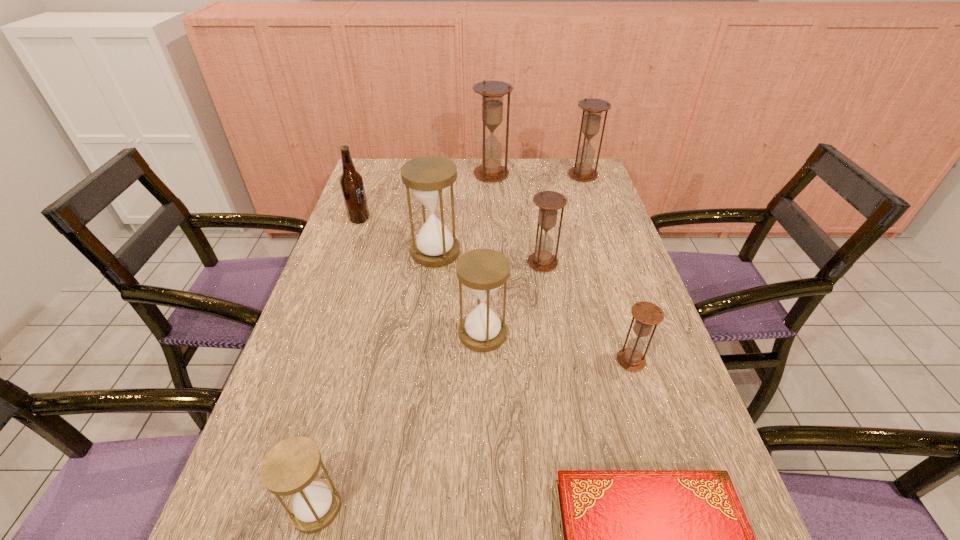
The width and height of the screenshot is (960, 540). In order to click on the rightmost white hourglass in this screenshot , I will do (483, 271).

Identify the location of the smallest brown hourglass. (647, 314).

Where is `the leftmost hourglass`? This screenshot has width=960, height=540. the leftmost hourglass is located at coordinates (290, 467).

You are a GUI agent. You are given a task and a screenshot of the screen. Output one action in this format:
    pyautogui.click(x=<x>, y=<y>)
    Task: Click on the nearest white hourglass
    The height and width of the screenshot is (540, 960).
    Given the screenshot: What is the action you would take?
    coord(290,467)

I want to click on vacant space located on the left of the tallest object, so click(371, 174).

Locate an element on the screen. This screenshot has width=960, height=540. free space located on the front of the second biggest brown hourglass is located at coordinates click(x=598, y=220).

Identify the location of free location located 0.390m on the right of the farthest white hourglass. (593, 252).

Locate an element on the screen. free space located on the label of the beer bottle is located at coordinates (463, 219).

In order to click on vacant space located on the back of the third hourglass from right to left in this screenshot , I will do `click(539, 239)`.

Where is `vacant region located on the front of the second biggest white hourglass`? This screenshot has width=960, height=540. vacant region located on the front of the second biggest white hourglass is located at coordinates (483, 374).